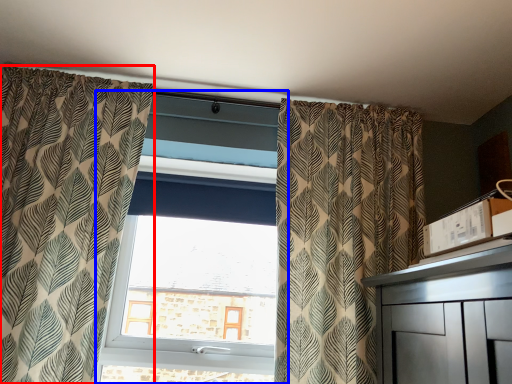
Question: Which object appears closest to the camera in this image, curtain (highlighted by a red box) or window (highlighted by a blue box)?

Choices:
 (A) curtain
 (B) window

Answer: (A)